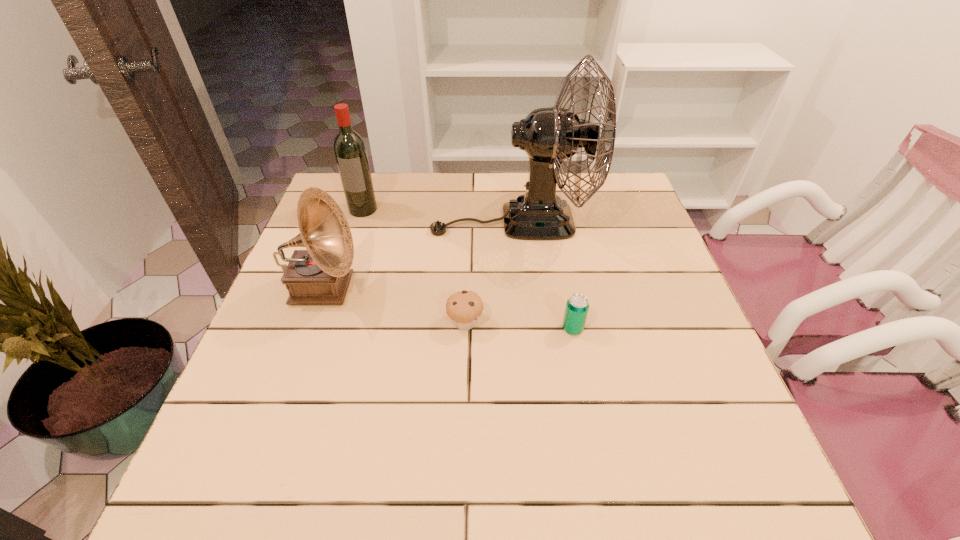
Where is `free space between the tallest object and the phonograph record`? Image resolution: width=960 pixels, height=540 pixels. free space between the tallest object and the phonograph record is located at coordinates (418, 255).

What are the coordinates of `object that can be found as the closest to the shortest object` in the screenshot? It's located at (549, 135).

You are a GUI agent. You are given a task and a screenshot of the screen. Output one action in this format:
    pyautogui.click(x=<x>, y=<y>)
    Task: Click on the object identified as the third closest to the wine bottle
    The image size is (960, 540).
    Given the screenshot: What is the action you would take?
    pyautogui.click(x=464, y=308)

You are a GUI agent. You are given a task and a screenshot of the screen. Output one action in this format:
    pyautogui.click(x=<x>, y=<y>)
    Task: Click on the vacant region that satisfies the following two spatial constraints: 1. on the label of the beer can; 2. on the right side of the wine bottle
    The image size is (960, 540).
    Given the screenshot: What is the action you would take?
    pyautogui.click(x=324, y=328)

Locate an element on the screen. The width and height of the screenshot is (960, 540). vacant space that satisfies the following two spatial constraints: 1. on the label of the beer can; 2. on the right side of the wine bottle is located at coordinates (324, 328).

Find the location of a particular element. Image resolution: width=960 pixels, height=540 pixels. blank space that satisfies the following two spatial constraints: 1. in front of the beer can, indicating the direction of air flow; 2. on the right side of the fan is located at coordinates (522, 328).

In order to click on vacant space that satisfies the following two spatial constraints: 1. on the label of the wine bottle; 2. on the right side of the shortest object in this screenshot , I will do `click(326, 323)`.

Where is `free spot that satisfies the following two spatial constraints: 1. on the label of the shortest object; 2. on the left side of the wine bottle`? This screenshot has width=960, height=540. free spot that satisfies the following two spatial constraints: 1. on the label of the shortest object; 2. on the left side of the wine bottle is located at coordinates (326, 323).

Where is `free location that satisfies the following two spatial constraints: 1. on the back side of the beer can; 2. in front of the tallest object, indicating the direction of air flow`? free location that satisfies the following two spatial constraints: 1. on the back side of the beer can; 2. in front of the tallest object, indicating the direction of air flow is located at coordinates (552, 221).

Locate an element on the screen. Image resolution: width=960 pixels, height=540 pixels. vacant area in the image that satisfies the following two spatial constraints: 1. on the horn of the third tallest object; 2. on the left side of the beer can is located at coordinates point(309,328).